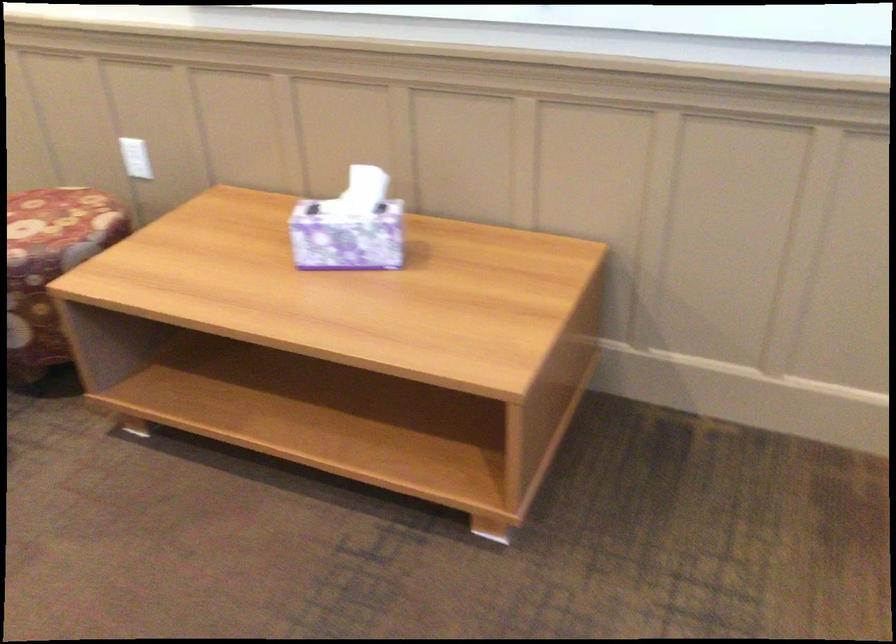
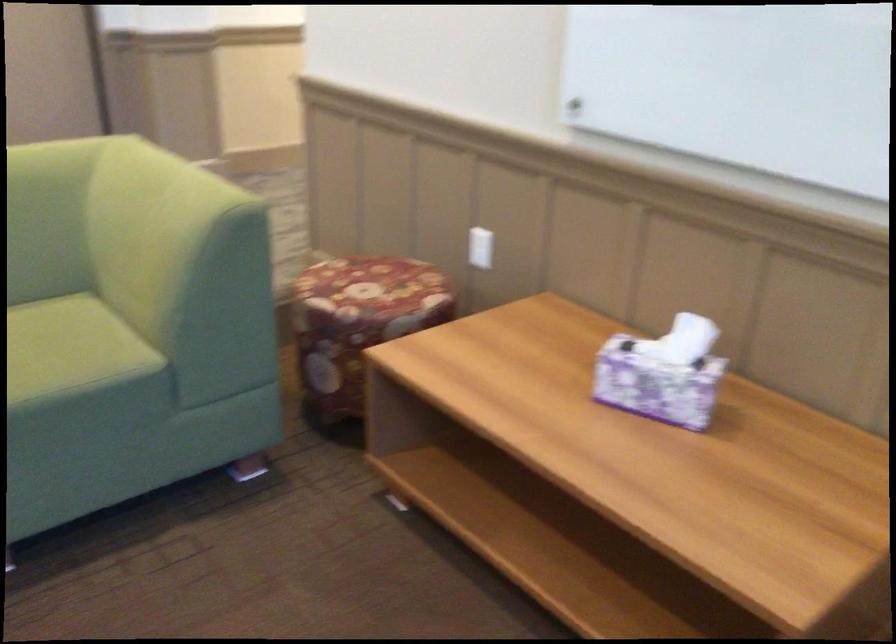
Locate, in the second image, the point that corresponds to point (135, 163) in the first image.

(479, 247)